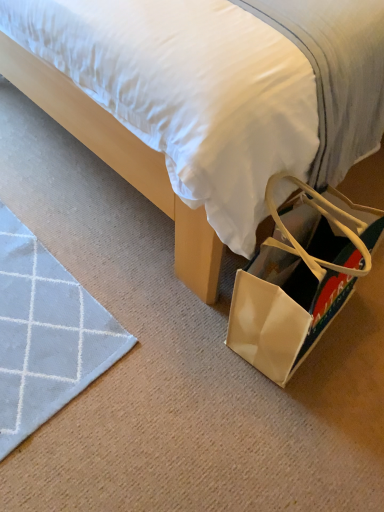
Where is `vacant space in front of matte beige shoulder bag at lower right`? Image resolution: width=384 pixels, height=512 pixels. vacant space in front of matte beige shoulder bag at lower right is located at coordinates (291, 425).